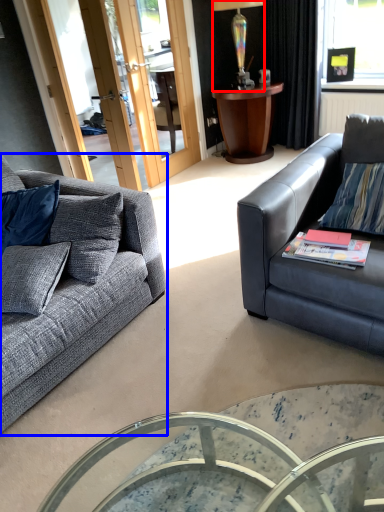
Question: Which object is closer to the camera taking this photo, lamp (highlighted by a red box) or studio couch (highlighted by a blue box)?

Choices:
 (A) lamp
 (B) studio couch

Answer: (B)